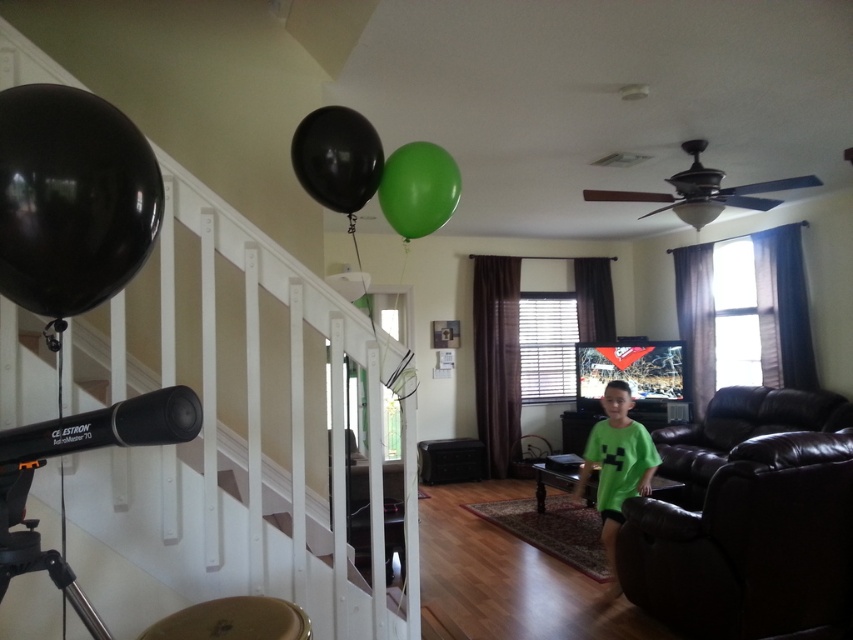
Who is more distant from viewer, (619, 456) or (44, 464)?

Positioned behind is point (619, 456).

At what (x,y) coordinates should I click in order to perform the action: click on green matte shirt at lower center. Please return your answer as a coordinate pair (x, y). This screenshot has width=853, height=640. Looking at the image, I should click on (616, 468).

Based on the photo, between black rubber balloon at upper center and green matte shirt at lower center, which one appears on the left side from the viewer's perspective?

Positioned to the left is black rubber balloon at upper center.

Is black rubber balloon at upper center positioned in front of green matte shirt at lower center?

Yes, it is.

Between point (358, 116) and point (608, 554), which one is positioned behind?

Point (608, 554)

Identify the location of black rubber balloon at upper center. The height and width of the screenshot is (640, 853). (337, 157).

Does point (395, 195) lie behind point (190, 632)?

Yes, it is behind point (190, 632).

Does point (407, 224) come closer to viewer compared to point (270, 604)?

No, (407, 224) is behind (270, 604).

Find the location of `green rubber balloon at upper center`. green rubber balloon at upper center is located at coordinates pyautogui.click(x=418, y=188).

Where is `green rubber balloon at upper center`? This screenshot has height=640, width=853. green rubber balloon at upper center is located at coordinates (418, 188).